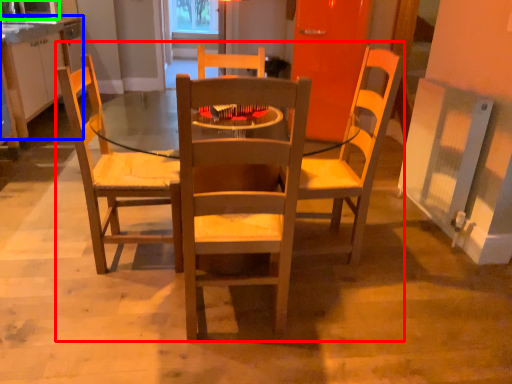
Question: Which object is the closest to the trio (highlighted by a red box)? Choose among these: cabinetry (highlighted by a blue box) or microwave oven (highlighted by a green box).

Choices:
 (A) cabinetry
 (B) microwave oven

Answer: (A)